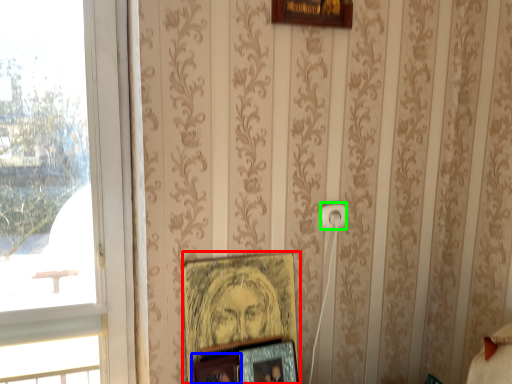
Question: Considering the real-world distances, which object is closest to picture frame (highlighted by a red box)? picture frame (highlighted by a blue box) or electric outlet (highlighted by a green box).

Choices:
 (A) picture frame
 (B) electric outlet

Answer: (A)